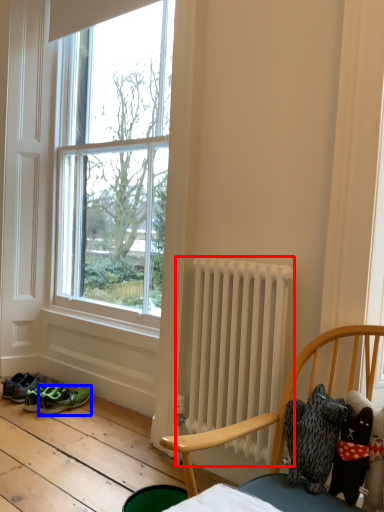
Question: Which object is closer to the camera taking this photo, radiator (highlighted by a red box) or footwear (highlighted by a blue box)?

Choices:
 (A) radiator
 (B) footwear

Answer: (A)